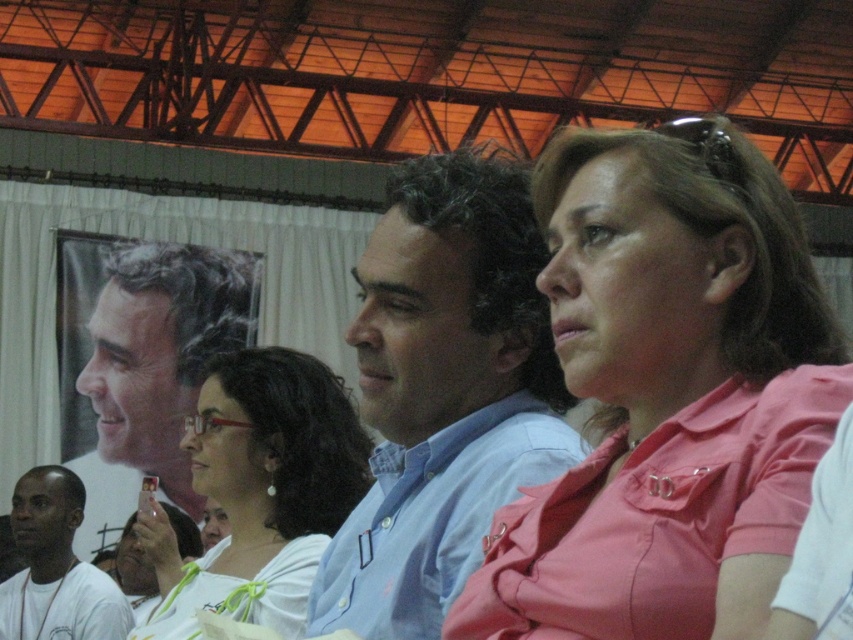
You are a photographer taking a picture of the group. You notice the pink fabric shirt at center and the light blue shirt at center. Which shirt should you focus on to ensure the entire length of the shirt is visible in the photo?

The pink fabric shirt at center is shorter than the light blue shirt at center, so focusing on the light blue shirt at center would ensure the entire length is visible since it is longer.

You are a photographer trying to capture a group photo of the light blue shirt at center and the white matte shirt at lower left. Since you want both subjects to appear equally sized in the photo, which subject should you move closer to the camera?

You should move closer to the light blue shirt at center because it is taller than the white matte shirt at lower left, so moving closer to the taller subject will help balance their sizes in the photo.

Based on the scene description, where is the light blue shirt at center located in terms of coordinates?

The light blue shirt at center is located at coordinates point [444,392].